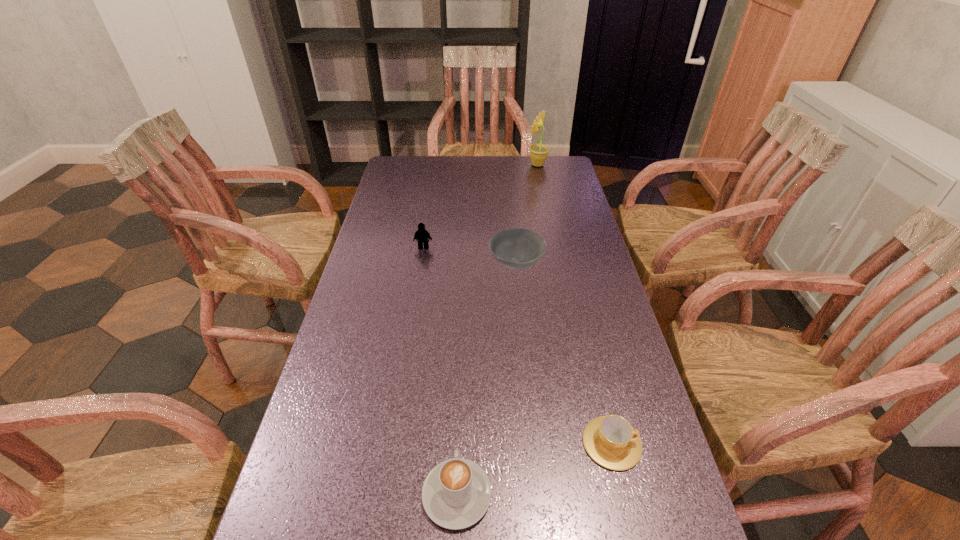
Locate an element on the screen. the farthest object is located at coordinates (538, 152).

Locate an element on the screen. sunflower is located at coordinates (538, 152).

I want to click on the leftmost object, so click(x=423, y=236).

Identify the location of cappuccino. (456, 493).

What are the coordinates of `bowl` in the screenshot? It's located at (517, 248).

Where is `the shortest object`? the shortest object is located at coordinates (611, 441).

Find the location of a particular element. vacant space located 0.190m on the face of the farthest object is located at coordinates (481, 165).

You are a GUI agent. You are given a task and a screenshot of the screen. Output one action in this format:
    pyautogui.click(x=<x>, y=<y>)
    Task: Click on the free location located 0.160m on the face of the farthest object
    The image size is (960, 540).
    Given the screenshot: What is the action you would take?
    pyautogui.click(x=488, y=165)

Where is `free space located on the face of the farthest object`? This screenshot has height=540, width=960. free space located on the face of the farthest object is located at coordinates (488, 165).

Image resolution: width=960 pixels, height=540 pixels. What are the coordinates of `free space located on the face of the leftmost object` in the screenshot? It's located at (410, 330).